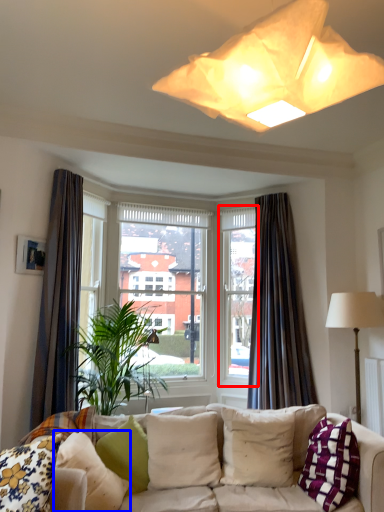
Question: Which of the following is the closest to the observer, window frame (highlighted by a red box) or pillow (highlighted by a blue box)?

Choices:
 (A) window frame
 (B) pillow

Answer: (B)